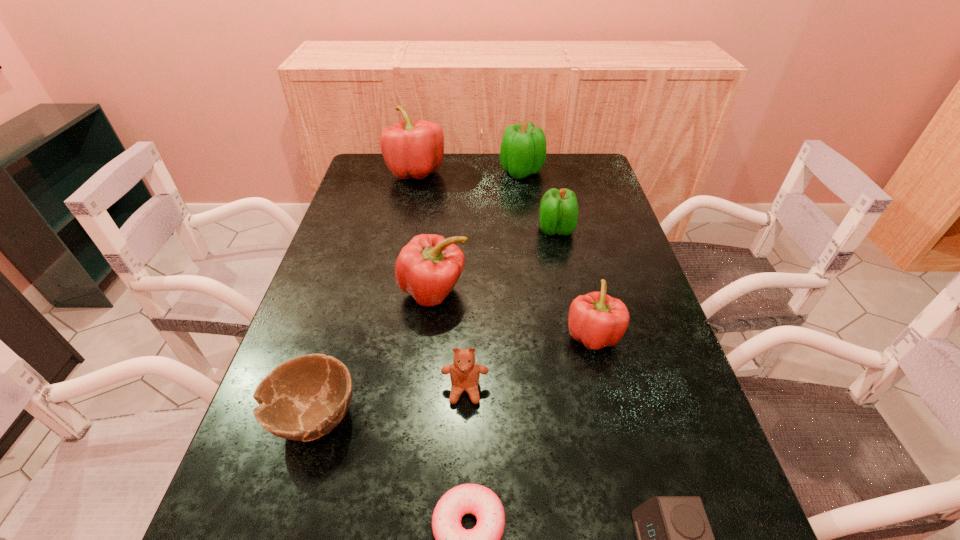
In the image, there is a desktop. Identify the location of vacant space at the far left corner. Image resolution: width=960 pixels, height=540 pixels. (368, 160).

Find the location of a particular element. free region at the far right corner of the desktop is located at coordinates (597, 174).

The height and width of the screenshot is (540, 960). In order to click on vacant region between the teddy bear and the rightmost pink bell pepper in this screenshot , I will do `click(529, 363)`.

Locate an element on the screen. The height and width of the screenshot is (540, 960). free space between the rightmost pink bell pepper and the farthest pink bell pepper is located at coordinates (504, 254).

The image size is (960, 540). Identify the location of blank region between the biggest pink bell pepper and the smaller green bell pepper. (486, 201).

Where is `empty space between the smaller green bell pepper and the second biggest pink bell pepper`? empty space between the smaller green bell pepper and the second biggest pink bell pepper is located at coordinates (495, 261).

Where is `unoccupied area between the teddy bear and the rightmost pink bell pepper`? The image size is (960, 540). unoccupied area between the teddy bear and the rightmost pink bell pepper is located at coordinates (529, 363).

Where is `free space between the third shortest object and the biggest pink bell pepper`? Image resolution: width=960 pixels, height=540 pixels. free space between the third shortest object and the biggest pink bell pepper is located at coordinates (365, 295).

In order to click on free spot between the teddy bear and the bowl in this screenshot , I will do `click(390, 403)`.

You are a GUI agent. You are given a task and a screenshot of the screen. Output one action in this format:
    pyautogui.click(x=<x>, y=<y>)
    Task: Click on the unoccupied position between the smallest pink bell pepper and the third nearest bell pepper
    The width and height of the screenshot is (960, 540).
    Given the screenshot: What is the action you would take?
    pyautogui.click(x=574, y=282)